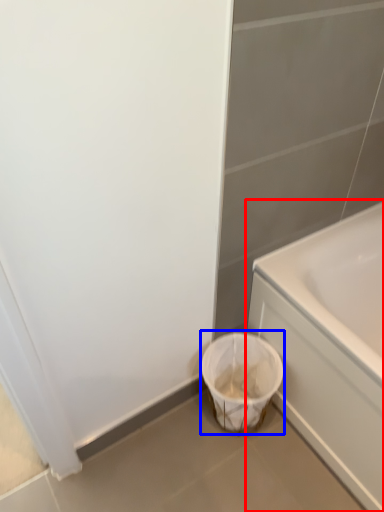
Question: Among these objects, which one is nearest to the camera, bathtub (highlighted by a red box) or laundry basket (highlighted by a blue box)?

Choices:
 (A) bathtub
 (B) laundry basket

Answer: (A)